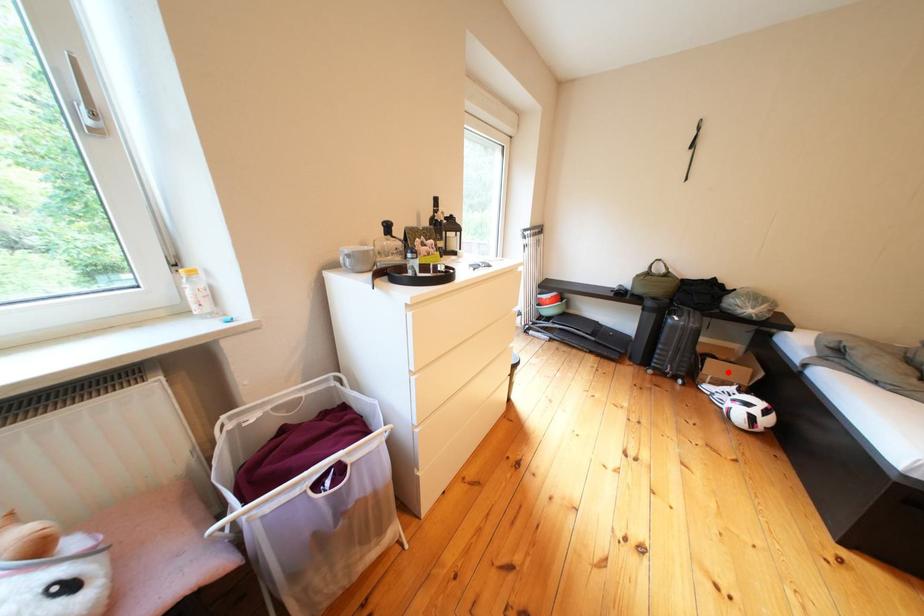
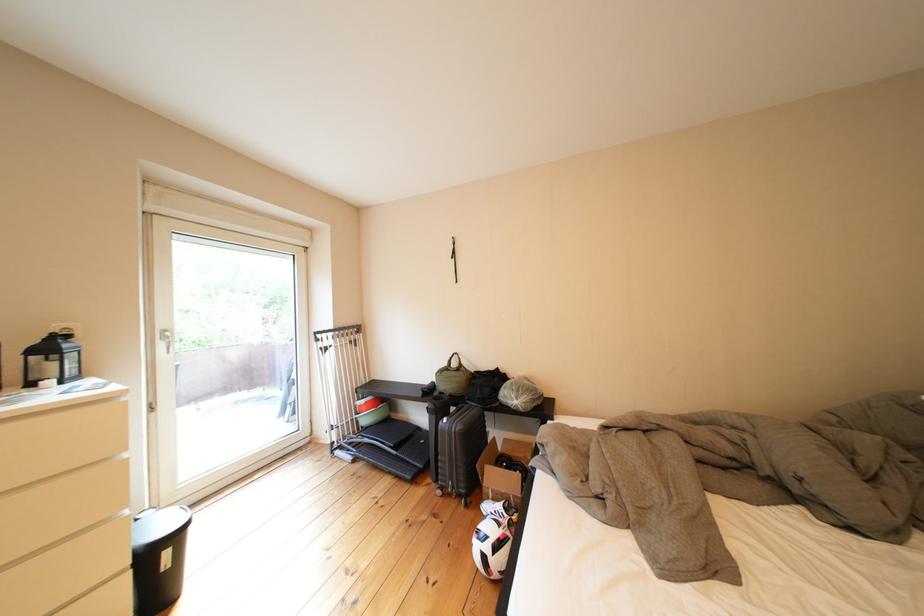
Question: A red point is marked in image1. In image2, is the corresponding 3D point closer to the camera or farther? Reply with the corresponding letter.

Choices:
 (A) The corresponding 3D point is closer.
 (B) The corresponding 3D point is farther.

Answer: (A)